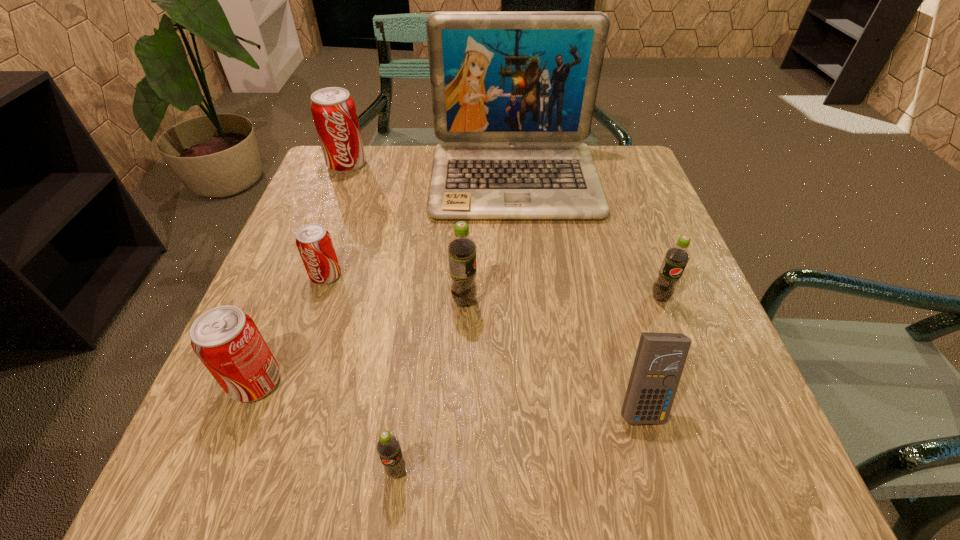
The image size is (960, 540). I want to click on vacant space that is in between the fifth farthest soda and the second smallest green soda, so click(x=458, y=339).

The width and height of the screenshot is (960, 540). I want to click on vacant space in between the second nearest red soda can and the second smallest red soda can, so click(x=291, y=328).

Identify the location of blank region between the tallest object and the fifth nearest soda. (420, 227).

The image size is (960, 540). In order to click on object identified as the fourth closest to the nearest red soda can in this screenshot , I will do `click(513, 93)`.

Image resolution: width=960 pixels, height=540 pixels. What are the coordinates of `the closest object relative to the second green soda from right to left` in the screenshot? It's located at (513, 93).

The image size is (960, 540). In order to click on soda that is the fourth nearest to the second farthest soda in this screenshot , I will do `click(388, 448)`.

Identify which soda is located as the nearest to the second biggest red soda can. Please provide its 2D coordinates. Your answer should be formatted as a tuple, i.e. [(x, y)], where the tuple contains the x and y coordinates of a point satisfying the conditions above.

[(314, 243)]

Locate an element on the screen. red soda can that is the second closest to the rightmost soda is located at coordinates (227, 341).

Identify which red soda can is the nearest to the fifth nearest soda. Please provide its 2D coordinates. Your answer should be formatted as a tuple, i.e. [(x, y)], where the tuple contains the x and y coordinates of a point satisfying the conditions above.

[(227, 341)]

Identify which green soda is the second nearest to the nearest object. Please provide its 2D coordinates. Your answer should be formatted as a tuple, i.e. [(x, y)], where the tuple contains the x and y coordinates of a point satisfying the conditions above.

[(676, 258)]